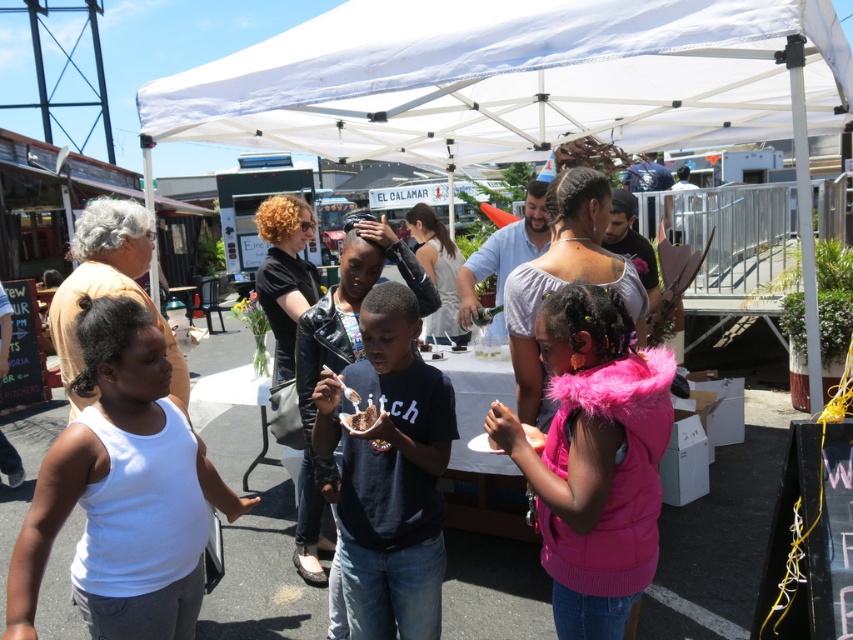
You are standing at the position of the child holding the spoon and looking towards the table. Which of the two points, point [428,552] or point [361,420], is closer to you?

Point [428,552] is further to the camera than point [361,420], so the closer point to you is point [361,420].

You are a photographer trying to capture a photo of the black matte shirt at center under the white fabric canopy at upper center. Since the canopy is larger, will it completely block sunlight from hitting the shirt?

The white fabric canopy at upper center is bigger than the black matte shirt at center, so it can completely block sunlight from hitting the black matte shirt at center.